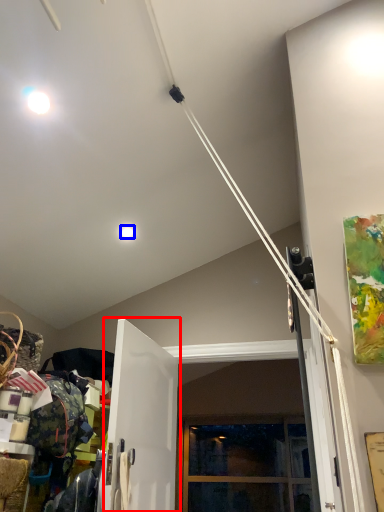
Question: Which object is closer to the camera taking this photo, door (highlighted by a red box) or droplight (highlighted by a blue box)?

Choices:
 (A) door
 (B) droplight

Answer: (A)